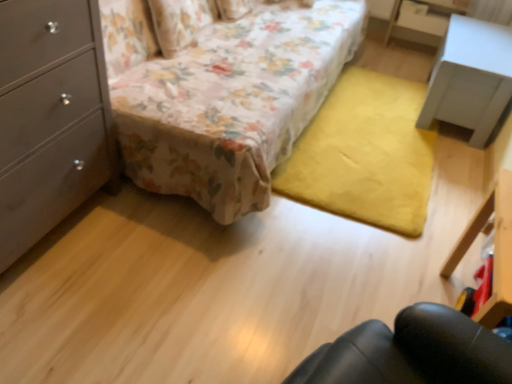
Question: From the image's perspective, is white matte nightstand at upper right positioned above or below black plastic vanity at lower right?

Choices:
 (A) below
 (B) above

Answer: (B)

Question: Is white matte nightstand at upper right in front of or behind black plastic vanity at lower right in the image?

Choices:
 (A) behind
 (B) front

Answer: (A)

Question: Based on their relative distances, which object is farther from the floral fabric pillow at upper left?

Choices:
 (A) matte gray dresser at left
 (B) black plastic vanity at lower right
 (C) floral fabric couch at center
 (D) white matte nightstand at upper right

Answer: (B)

Question: Which is farther from the white matte nightstand at upper right?

Choices:
 (A) floral fabric couch at center
 (B) black plastic vanity at lower right
 (C) matte gray dresser at left
 (D) floral fabric pillow at upper left

Answer: (C)